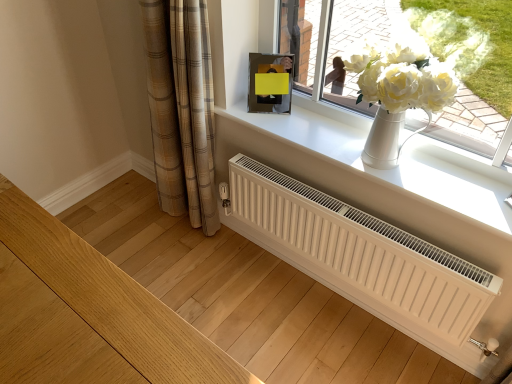
Identify the location of free space in front of plaid fabric curtain at lower left. This screenshot has width=512, height=384. (185, 262).